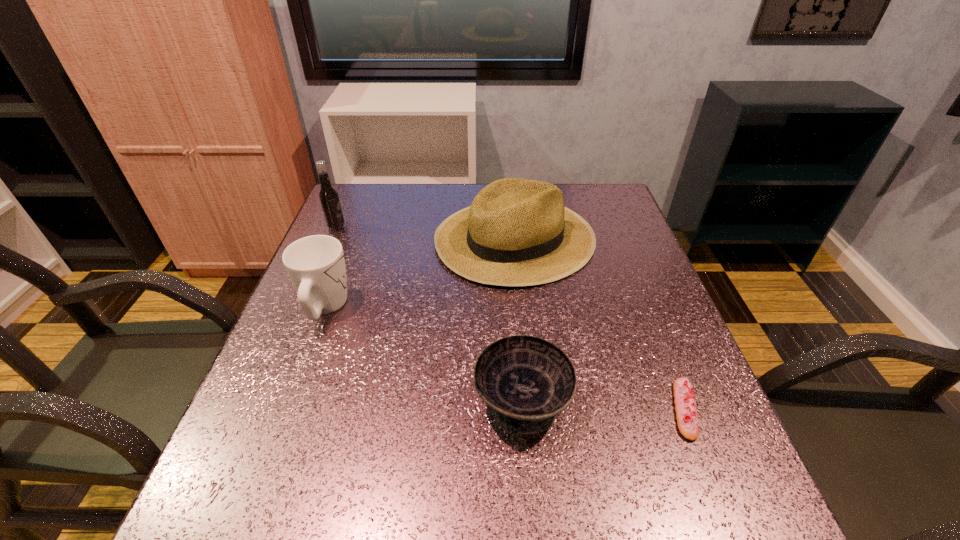
The width and height of the screenshot is (960, 540). In order to click on free space between the mug and the fourth tallest object in this screenshot , I will do `click(423, 354)`.

In order to click on unoccupied position between the root beer and the sunhat in this screenshot , I will do `click(425, 232)`.

Identify the location of free area in between the tallest object and the second shortest object. The image size is (960, 540). (429, 314).

Locate an element on the screen. The width and height of the screenshot is (960, 540). free space between the root beer and the bowl is located at coordinates (429, 314).

Find the location of a particular element. free spot between the fourth tallest object and the mug is located at coordinates (423, 354).

Point out which object is positioned as the nearest to the sunhat. Please provide its 2D coordinates. Your answer should be formatted as a tuple, i.e. [(x, y)], where the tuple contains the x and y coordinates of a point satisfying the conditions above.

[(315, 264)]

Identify which object is located as the third nearest to the eclair. Please provide its 2D coordinates. Your answer should be formatted as a tuple, i.e. [(x, y)], where the tuple contains the x and y coordinates of a point satisfying the conditions above.

[(315, 264)]

Find the location of `vacant region that satisfies the following two spatial constraints: 1. on the label of the rightmost object; 2. on the right side of the root beer`. vacant region that satisfies the following two spatial constraints: 1. on the label of the rightmost object; 2. on the right side of the root beer is located at coordinates (258, 409).

Where is `blank space that satisfies the following two spatial constraints: 1. on the side of the sunhat with the handle; 2. on the right side of the mug`? The width and height of the screenshot is (960, 540). blank space that satisfies the following two spatial constraints: 1. on the side of the sunhat with the handle; 2. on the right side of the mug is located at coordinates (351, 238).

Image resolution: width=960 pixels, height=540 pixels. Identify the location of vacant area that satisfies the following two spatial constraints: 1. on the label of the bowl; 2. on the right side of the root beer. (262, 401).